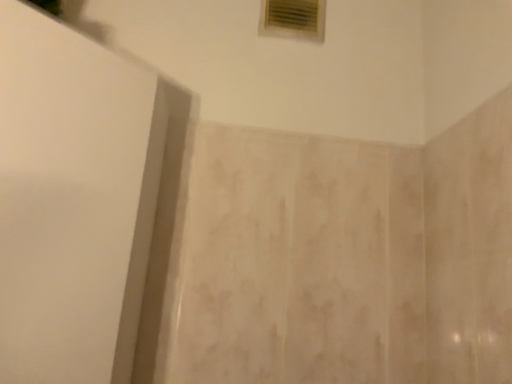
Question: Is white plastic vent at upper center to the left or to the right of white matte screen door at left in the image?

Choices:
 (A) right
 (B) left

Answer: (A)

Question: In terms of width, does white plastic vent at upper center look wider or thinner when compared to white matte screen door at left?

Choices:
 (A) thin
 (B) wide

Answer: (A)

Question: From the image's perspective, is white plastic vent at upper center located above or below white matte screen door at left?

Choices:
 (A) below
 (B) above

Answer: (B)

Question: Is white matte screen door at left spatially inside white plastic vent at upper center, or outside of it?

Choices:
 (A) outside
 (B) inside

Answer: (A)

Question: In terms of size, does white matte screen door at left appear bigger or smaller than white plastic vent at upper center?

Choices:
 (A) big
 (B) small

Answer: (A)

Question: From the image's perspective, relative to white plastic vent at upper center, is white matte screen door at left above or below?

Choices:
 (A) above
 (B) below

Answer: (B)

Question: In the image, is white matte screen door at left on the left side or the right side of white plastic vent at upper center?

Choices:
 (A) right
 (B) left

Answer: (B)